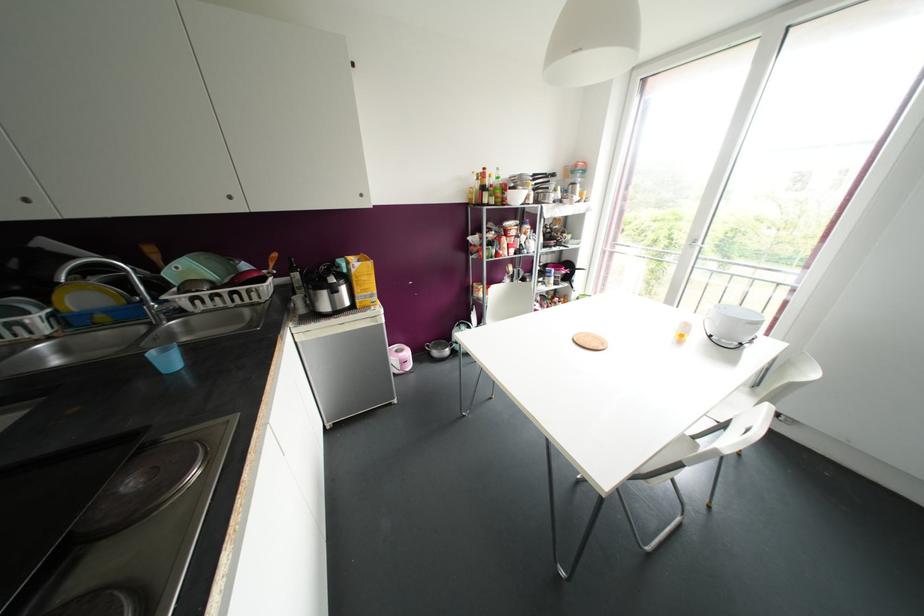
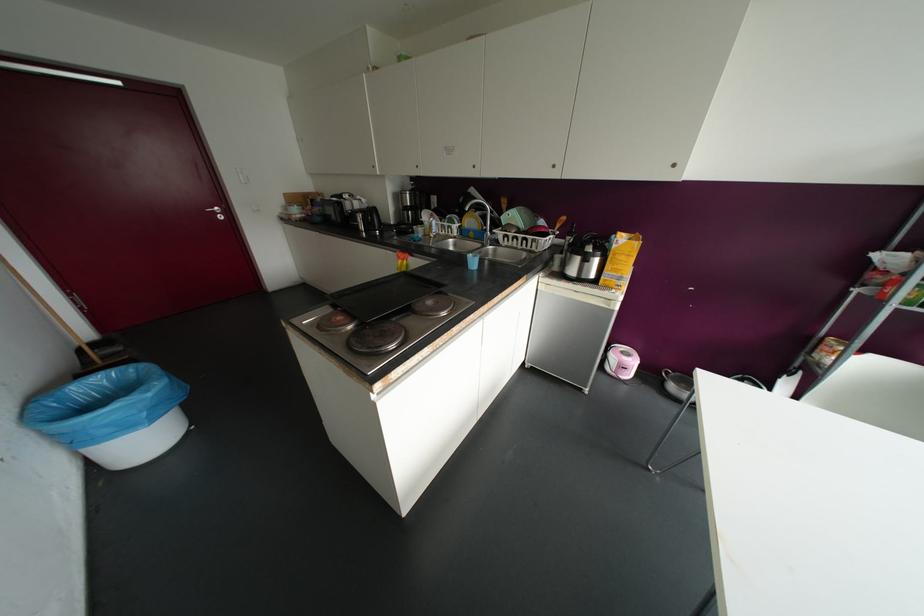
The point at (327,275) is marked in the first image. Where is the corresponding point in the second image?

(589, 244)